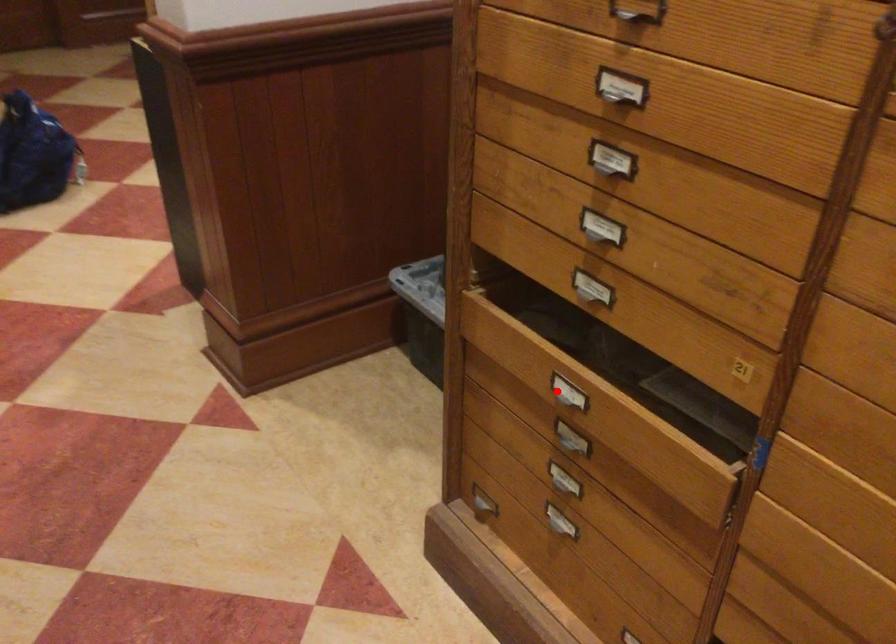
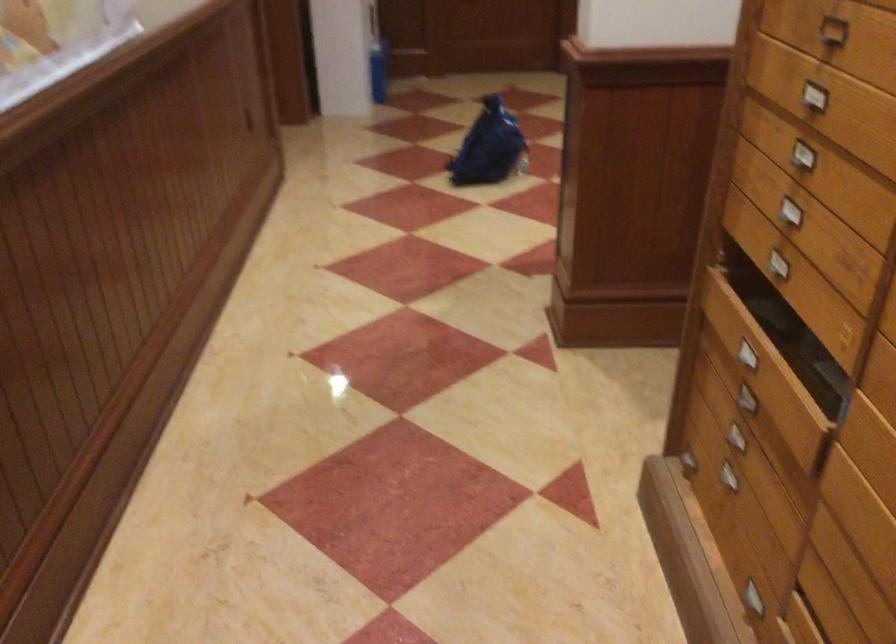
The point at the highlighted location is marked in the first image. Where is the corresponding point in the second image?

(746, 354)